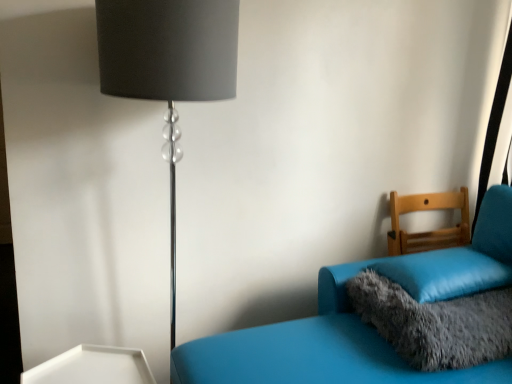
Question: Would you say fluffy gray pillow at lower right, which is the second pillow from top to bottom, is a long distance from soft blue pillow at right, marked as the second pillow in a bottom-to-top arrangement?

Choices:
 (A) yes
 (B) no

Answer: (B)

Question: From a real-world perspective, is fluffy gray pillow at lower right, the 1th pillow when ordered from bottom to top, over soft blue pillow at right, the first pillow viewed from the top?

Choices:
 (A) yes
 (B) no

Answer: (B)

Question: Does fluffy gray pillow at lower right, the 1th pillow when ordered from bottom to top, have a greater width compared to soft blue pillow at right, marked as the second pillow in a bottom-to-top arrangement?

Choices:
 (A) no
 (B) yes

Answer: (A)

Question: Is fluffy gray pillow at lower right, which is the second pillow from top to bottom, oriented towards soft blue pillow at right, marked as the second pillow in a bottom-to-top arrangement?

Choices:
 (A) yes
 (B) no

Answer: (B)

Question: Does fluffy gray pillow at lower right, which is the second pillow from top to bottom, lie in front of soft blue pillow at right, the first pillow viewed from the top?

Choices:
 (A) yes
 (B) no

Answer: (A)

Question: Do you think black metallic lamp at left is within soft blue pillow at right, the first pillow viewed from the top, or outside of it?

Choices:
 (A) inside
 (B) outside

Answer: (B)

Question: Is black metallic lamp at left taller or shorter than soft blue pillow at right, marked as the second pillow in a bottom-to-top arrangement?

Choices:
 (A) tall
 (B) short

Answer: (A)

Question: From the image's perspective, is black metallic lamp at left above or below soft blue pillow at right, marked as the second pillow in a bottom-to-top arrangement?

Choices:
 (A) above
 (B) below

Answer: (A)

Question: Considering the relative positions of black metallic lamp at left and soft blue pillow at right, the first pillow viewed from the top, in the image provided, is black metallic lamp at left to the left or to the right of soft blue pillow at right, the first pillow viewed from the top,?

Choices:
 (A) left
 (B) right

Answer: (A)

Question: Is matte blue couch at right, which is the first furniture in front-to-back order, bigger or smaller than fluffy gray pillow at lower right, the 1th pillow when ordered from bottom to top?

Choices:
 (A) small
 (B) big

Answer: (B)

Question: In terms of height, does matte blue couch at right, acting as the second furniture starting from the back, look taller or shorter compared to fluffy gray pillow at lower right, which is the second pillow from top to bottom?

Choices:
 (A) short
 (B) tall

Answer: (B)

Question: Looking at their shapes, would you say matte blue couch at right, acting as the second furniture starting from the back, is wider or thinner than fluffy gray pillow at lower right, the 1th pillow when ordered from bottom to top?

Choices:
 (A) wide
 (B) thin

Answer: (A)

Question: Is matte blue couch at right, acting as the second furniture starting from the back, to the left or to the right of fluffy gray pillow at lower right, the 1th pillow when ordered from bottom to top, in the image?

Choices:
 (A) right
 (B) left

Answer: (B)

Question: In terms of width, does light brown wooden chair at right, which ranks as the 1th furniture in back-to-front order, look wider or thinner when compared to black metallic lamp at left?

Choices:
 (A) thin
 (B) wide

Answer: (A)

Question: Is point (417, 246) positioned closer to the camera than point (181, 94)?

Choices:
 (A) closer
 (B) farther

Answer: (B)